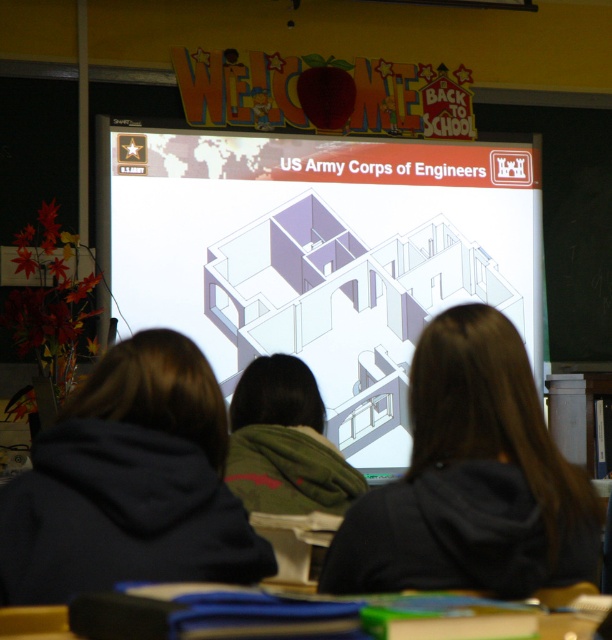
Between white glossy projection screen at upper center and dark gray hoodie at center, which one is positioned higher?

white glossy projection screen at upper center is higher up.

Does white glossy projection screen at upper center lie behind dark gray hoodie at center?

Yes, white glossy projection screen at upper center is further from the viewer.

Find the location of `white glossy projection screen at upper center`. white glossy projection screen at upper center is located at coordinates (319, 257).

Is white glossy projection screen at upper center taller than black matte hair at center?

Yes, white glossy projection screen at upper center is taller than black matte hair at center.

Between white glossy projection screen at upper center and black matte hair at center, which one appears on the left side from the viewer's perspective?

white glossy projection screen at upper center is more to the left.

Locate an element on the screen. The image size is (612, 640). white glossy projection screen at upper center is located at coordinates (319, 257).

Does dark gray hoodie at center have a lesser height compared to black matte hair at center?

Yes, dark gray hoodie at center is shorter than black matte hair at center.

Between point (171, 385) and point (428, 493), which one is positioned behind?

Point (171, 385)

I want to click on dark gray hoodie at center, so click(x=129, y=483).